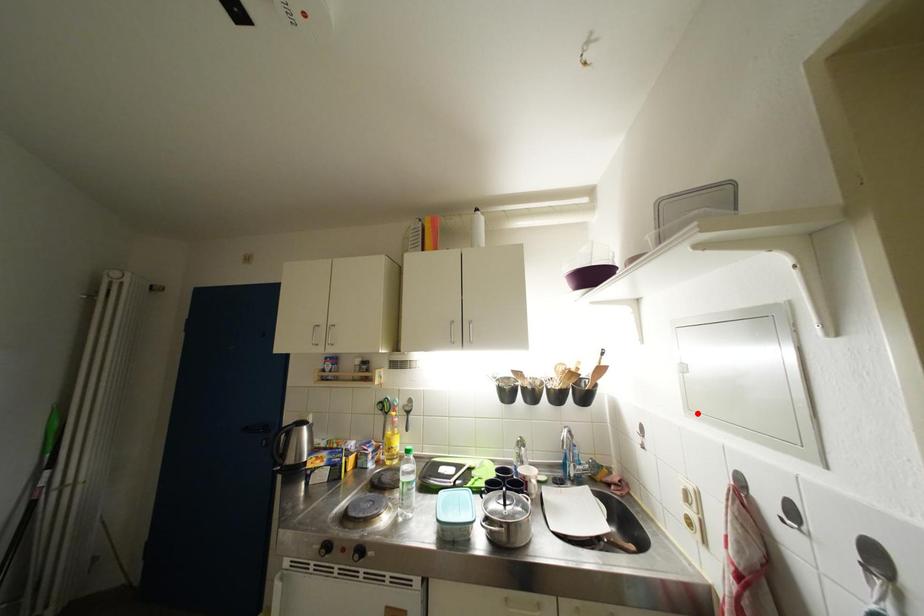
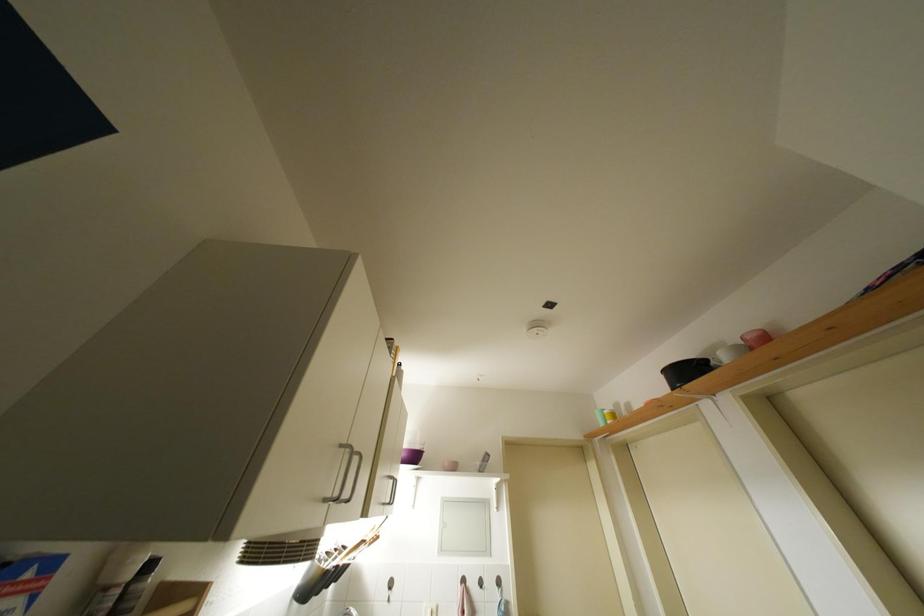
Find the pixel in the second image that matches the highlighted location in the first image.

(447, 554)